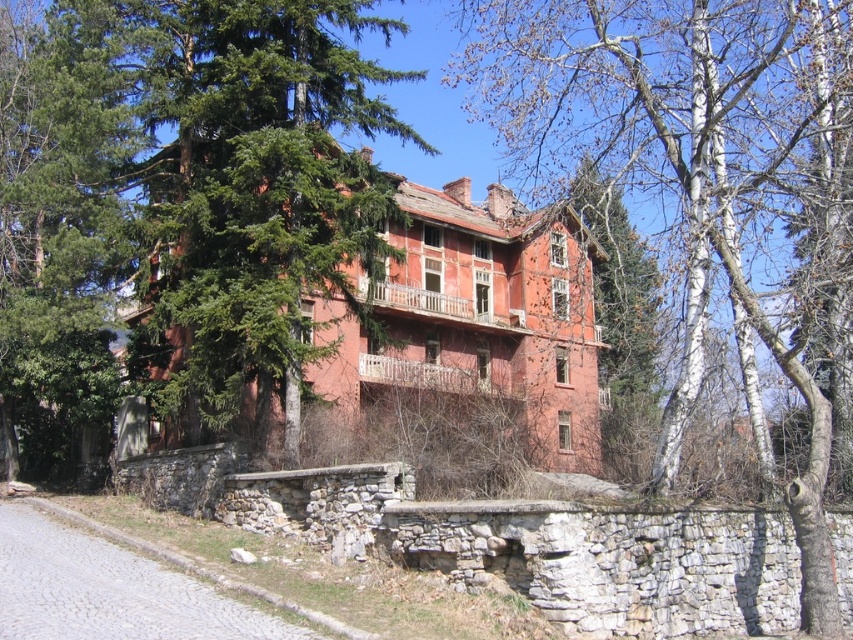
You are a bird seeking shelter. You see a bare birch tree at upper right and a green coniferous tree at upper left. Which tree has a wider canopy to provide better shelter?

The bare birch tree at upper right has a wider canopy than the green coniferous tree at upper left, so it provides better shelter.

You are standing in front of a historic brick building and notice a bare birch tree at upper right. If you want to take a closer look at the tree without moving your position, which direction should you look?

You should look towards the upper right to see the bare birch tree at upper right, as it is located in that direction and is 40.38 meters away from your current position.